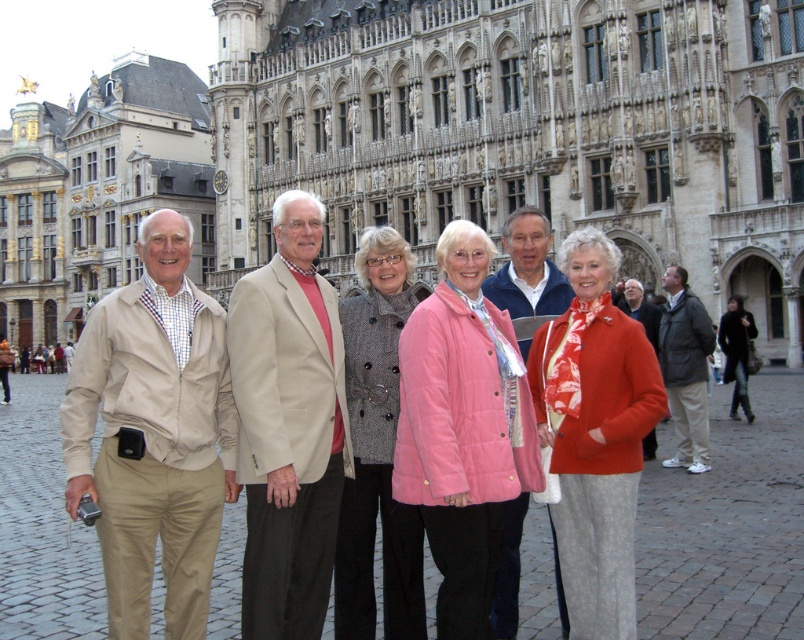
Question: Can you confirm if pink quilted jacket at center is positioned above blue quilted jacket at center?

Choices:
 (A) no
 (B) yes

Answer: (A)

Question: Does floral silk scarf at center lie in front of dark gray jacket at center?

Choices:
 (A) yes
 (B) no

Answer: (A)

Question: Estimate the real-world distances between objects in this image. Which object is farther from the dark gray jacket at center?

Choices:
 (A) beige fabric jacket at center
 (B) blue quilted jacket at center
 (C) orange quilted jacket at center

Answer: (A)

Question: Does pink quilted jacket at center have a greater width compared to blue quilted jacket at center?

Choices:
 (A) no
 (B) yes

Answer: (A)

Question: Which object is the closest to the orange quilted jacket at center?

Choices:
 (A) stone carved building at center
 (B) blue quilted jacket at center

Answer: (B)

Question: Which point is farther to the camera?

Choices:
 (A) pink quilted jacket at center
 (B) beige fabric jacket at left

Answer: (A)